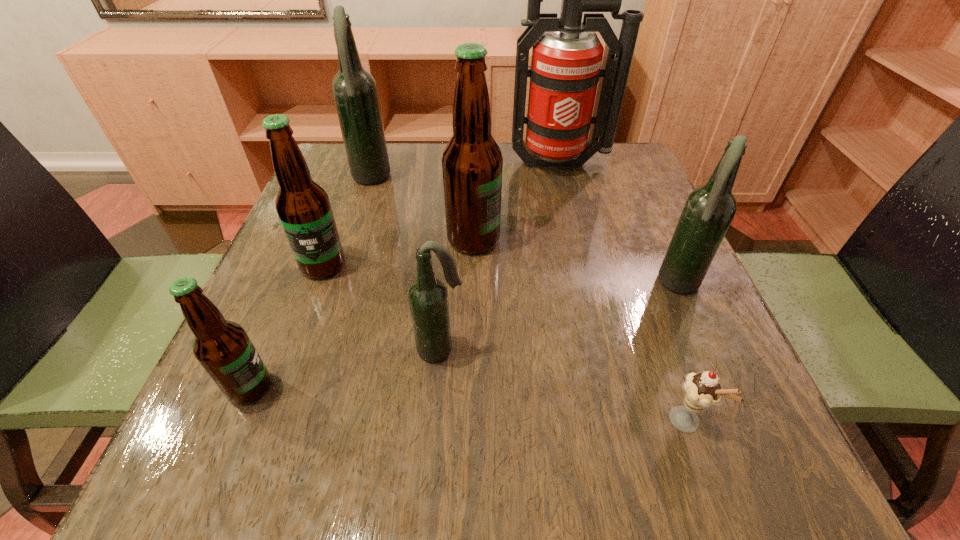
This screenshot has width=960, height=540. I want to click on free space that is in between the biggest brown beer bottle and the shortest object, so click(579, 330).

Find the location of a particular element. vacant area that lies between the rightmost brown beer bottle and the shortest object is located at coordinates (579, 330).

You are a GUI agent. You are given a task and a screenshot of the screen. Output one action in this format:
    pyautogui.click(x=<x>, y=<y>)
    Task: Click on the vacant region between the biggest dark beer bottle and the second biggest brown beer bottle
    The image size is (960, 540).
    Given the screenshot: What is the action you would take?
    [347, 222]

Where is `free spot between the shortest object and the second smallest brown beer bottle`? The image size is (960, 540). free spot between the shortest object and the second smallest brown beer bottle is located at coordinates (504, 343).

Locate an element on the screen. object that is the second closest one to the second smallest brown beer bottle is located at coordinates (472, 163).

You are a GUI agent. You are given a task and a screenshot of the screen. Output one action in this format:
    pyautogui.click(x=<x>, y=<y>)
    Task: Click on the object that stands as the sixth closest to the second dark beer bottle from left to right
    Image resolution: width=960 pixels, height=540 pixels.
    Given the screenshot: What is the action you would take?
    pyautogui.click(x=355, y=92)

This screenshot has height=540, width=960. Find the location of `the fourth closest beer bottle relative to the red fire extinguisher`. the fourth closest beer bottle relative to the red fire extinguisher is located at coordinates (303, 206).

Point out which beer bottle is positioned as the nearest to the icecream. Please provide its 2D coordinates. Your answer should be formatted as a tuple, i.e. [(x, y)], where the tuple contains the x and y coordinates of a point satisfying the conditions above.

[(709, 210)]

Identify the location of dark beer bottle that stands as the second closest to the second smallest brown beer bottle. The image size is (960, 540). (428, 298).

You are a GUI agent. You are given a task and a screenshot of the screen. Output one action in this format:
    pyautogui.click(x=<x>, y=<y>)
    Task: Click on the dark beer bottle that is the closest one to the second smallest dark beer bottle
    The width and height of the screenshot is (960, 540).
    Given the screenshot: What is the action you would take?
    pyautogui.click(x=428, y=298)